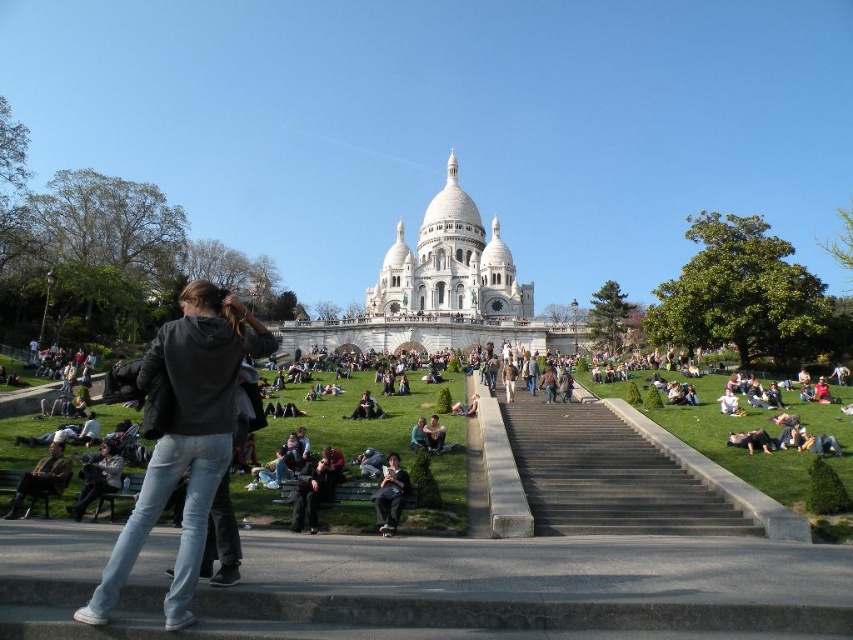
You are a tourist standing at the base of the staircase leading to the Sacre Coeur Basilica in Montmartre. You see two people wearing a dark gray hoodie at center and a brown leather jacket at lower left. Which person is closer to the basilica?

The dark gray hoodie at center is above the brown leather jacket at lower left, so the dark gray hoodie at center is closer to the basilica.

You are standing at the bottom of the black concrete stairs at center and want to find the dark gray hoodie at center. Which direction should you look to see it?

The dark gray hoodie at center is to the left of the black concrete stairs at center, so you should look to your left to see it.